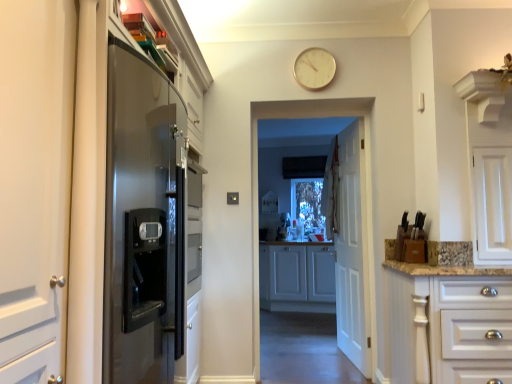
Question: Is the depth of white glossy cabinet at right, which appears as the first cabinetry when viewed from the front, less than that of gold metallic clock at upper center?

Choices:
 (A) no
 (B) yes

Answer: (B)

Question: Is white glossy cabinet at right, which appears as the first cabinetry when viewed from the front, positioned with its back to gold metallic clock at upper center?

Choices:
 (A) yes
 (B) no

Answer: (B)

Question: Is the depth of white glossy cabinet at right, which appears as the first cabinetry when viewed from the front, greater than that of gold metallic clock at upper center?

Choices:
 (A) yes
 (B) no

Answer: (B)

Question: Is white glossy cabinet at right, which appears as the first cabinetry when viewed from the front, bigger than gold metallic clock at upper center?

Choices:
 (A) no
 (B) yes

Answer: (B)

Question: From a real-world perspective, is white glossy cabinet at right, which appears as the first cabinetry when viewed from the front, beneath gold metallic clock at upper center?

Choices:
 (A) no
 (B) yes

Answer: (B)

Question: Is gold metallic clock at upper center inside the boundaries of white wooden door at center, or outside?

Choices:
 (A) inside
 (B) outside

Answer: (B)

Question: From the image's perspective, is gold metallic clock at upper center located above or below white wooden door at center?

Choices:
 (A) below
 (B) above

Answer: (B)

Question: Does point (309, 86) appear closer or farther from the camera than point (366, 349)?

Choices:
 (A) farther
 (B) closer

Answer: (B)

Question: Looking at the image, does gold metallic clock at upper center seem bigger or smaller compared to white wooden door at center?

Choices:
 (A) big
 (B) small

Answer: (B)

Question: Based on their positions, is gold metallic clock at upper center located to the left or right of white matte cabinet at center, the 1th cabinetry viewed from the back?

Choices:
 (A) right
 (B) left

Answer: (B)

Question: Is gold metallic clock at upper center inside the boundaries of white matte cabinet at center, the second cabinetry from the front, or outside?

Choices:
 (A) inside
 (B) outside

Answer: (B)

Question: From a real-world perspective, is gold metallic clock at upper center positioned above or below white matte cabinet at center, the 1th cabinetry viewed from the back?

Choices:
 (A) below
 (B) above

Answer: (B)

Question: Considering their positions, is gold metallic clock at upper center located in front of or behind white matte cabinet at center, the second cabinetry from the front?

Choices:
 (A) front
 (B) behind

Answer: (A)

Question: Considering the positions of white matte cabinet at center, the second cabinetry from the front, and white glossy cabinet at right, which appears as the first cabinetry when viewed from the front, in the image, is white matte cabinet at center, the second cabinetry from the front, taller or shorter than white glossy cabinet at right, which appears as the first cabinetry when viewed from the front,?

Choices:
 (A) short
 (B) tall

Answer: (B)

Question: From the image's perspective, is white matte cabinet at center, the second cabinetry from the front, positioned above or below white glossy cabinet at right, which appears as the first cabinetry when viewed from the front?

Choices:
 (A) above
 (B) below

Answer: (B)